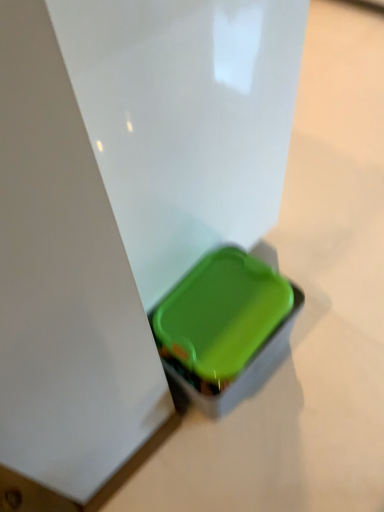
Identify the location of free space in front of green plastic container at lower center. (244, 454).